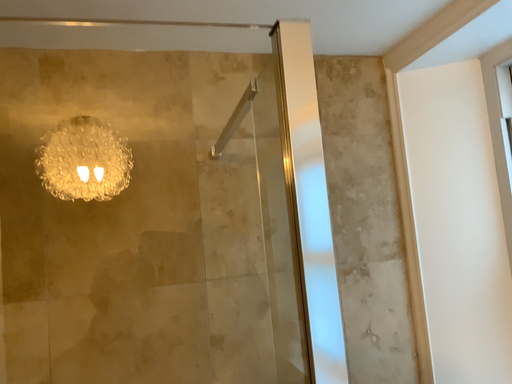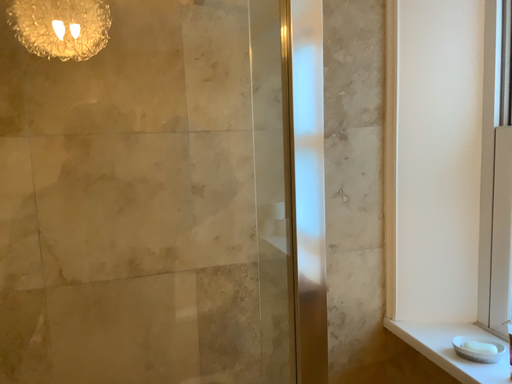
Question: How did the camera likely rotate when shooting the video?

Choices:
 (A) rotated upward
 (B) rotated downward

Answer: (B)